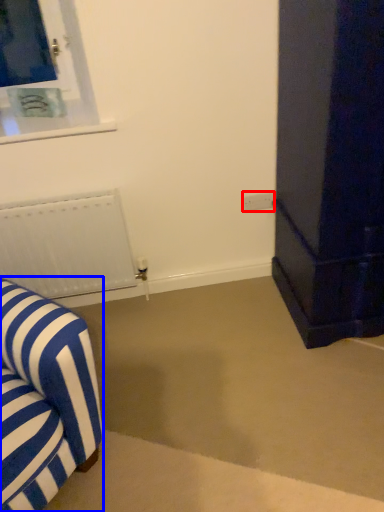
Question: Which of the following is the farthest to the observer, electric outlet (highlighted by a red box) or furniture (highlighted by a blue box)?

Choices:
 (A) electric outlet
 (B) furniture

Answer: (A)